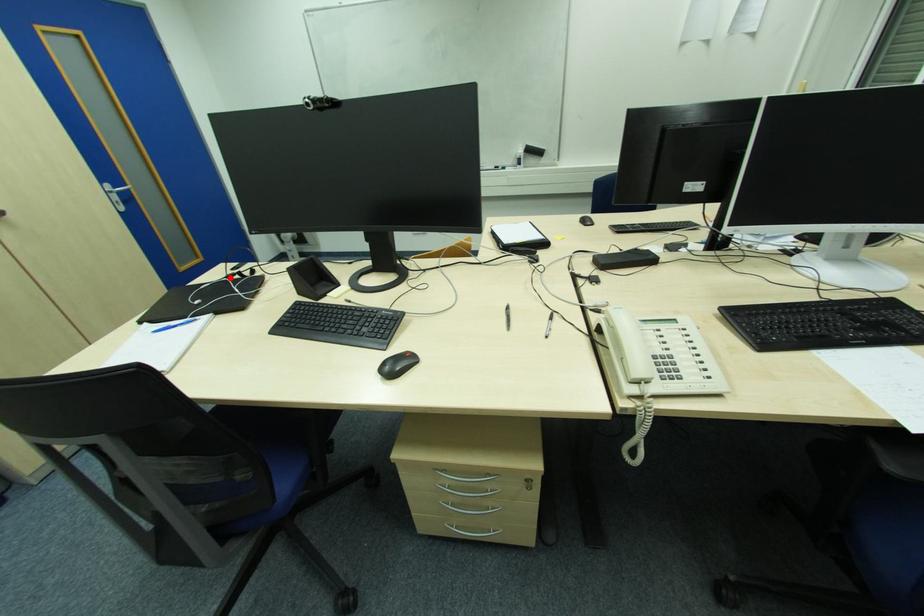
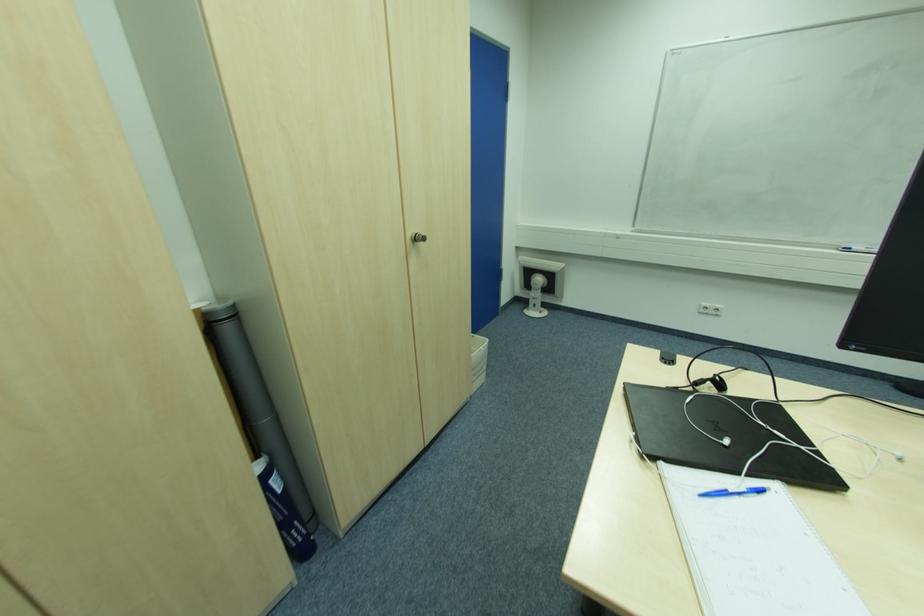
Where in the second image is the point corresponding to the highlighted location from the first image?

(699, 385)